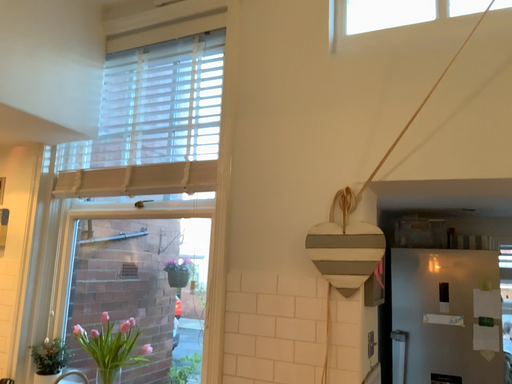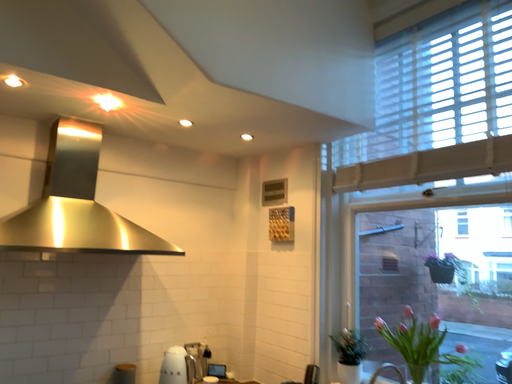
Question: Which way did the camera rotate in the video?

Choices:
 (A) rotated right
 (B) rotated left

Answer: (B)